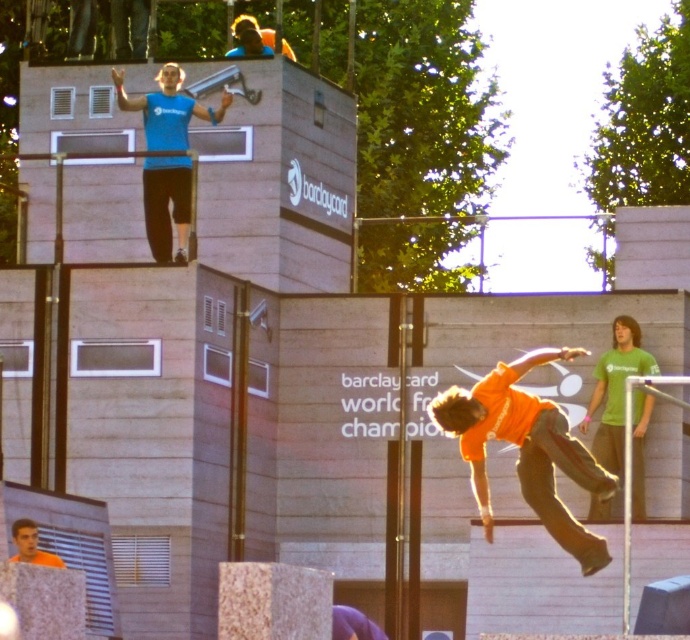
Question: Estimate the real-world distances between objects in this image. Which object is farther from the orange shirt at center?

Choices:
 (A) orange cotton shirt at center
 (B) matte blue shirt at upper center

Answer: (B)

Question: Can you confirm if matte blue shirt at upper center is bigger than orange shirt at center?

Choices:
 (A) no
 (B) yes

Answer: (A)

Question: Can you confirm if orange cotton shirt at center is positioned to the right of matte blue shirt at upper center?

Choices:
 (A) no
 (B) yes

Answer: (B)

Question: Which point is closer to the camera?

Choices:
 (A) matte blue shirt at upper center
 (B) orange shirt at center
 (C) orange cotton shirt at center

Answer: (B)

Question: Considering the relative positions of orange cotton shirt at center and matte blue shirt at upper center in the image provided, where is orange cotton shirt at center located with respect to matte blue shirt at upper center?

Choices:
 (A) left
 (B) right

Answer: (B)

Question: Which is nearer to the orange shirt at center?

Choices:
 (A) orange cotton shirt at center
 (B) matte blue shirt at upper center

Answer: (A)